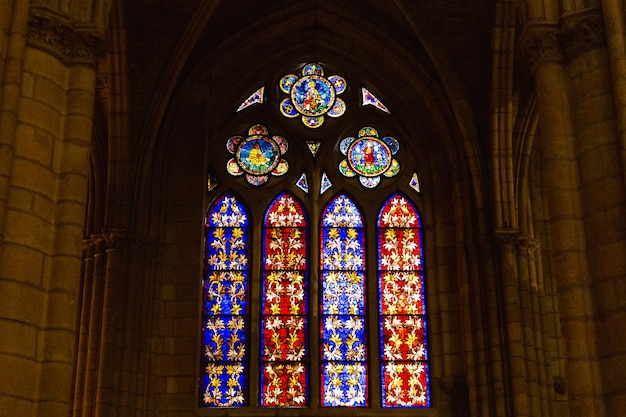
This screenshot has width=626, height=417. In order to click on red long windows in this screenshot , I will do `click(293, 260)`, `click(409, 254)`.